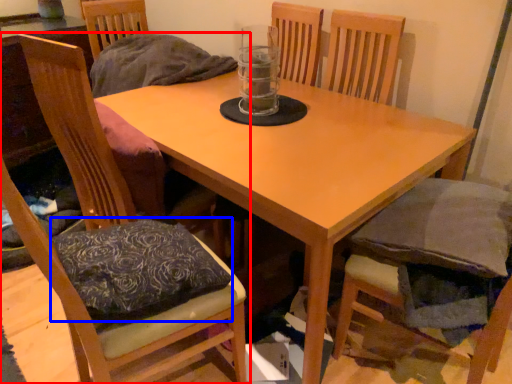
Question: Which of the following is the closest to the observer, chair (highlighted by a red box) or pillow (highlighted by a blue box)?

Choices:
 (A) chair
 (B) pillow

Answer: (A)